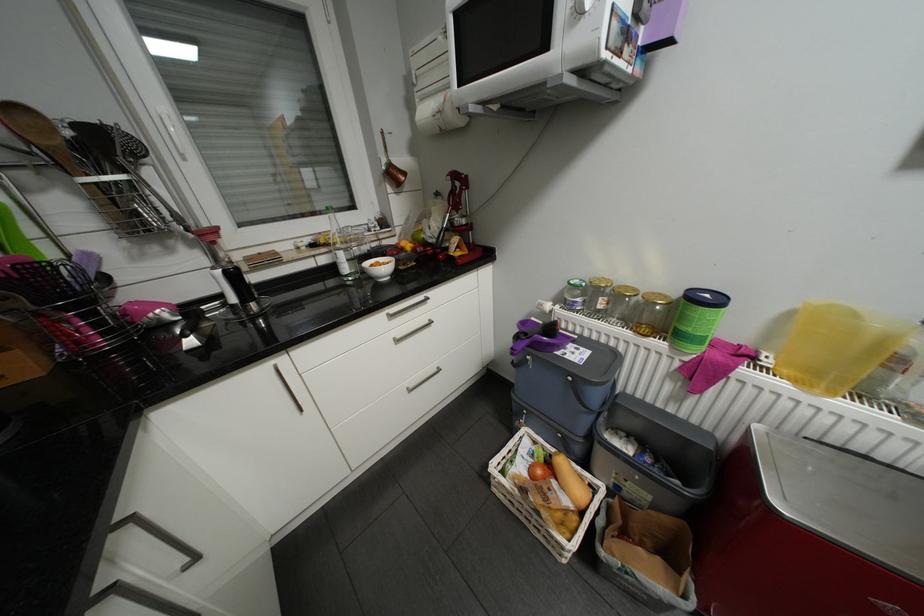
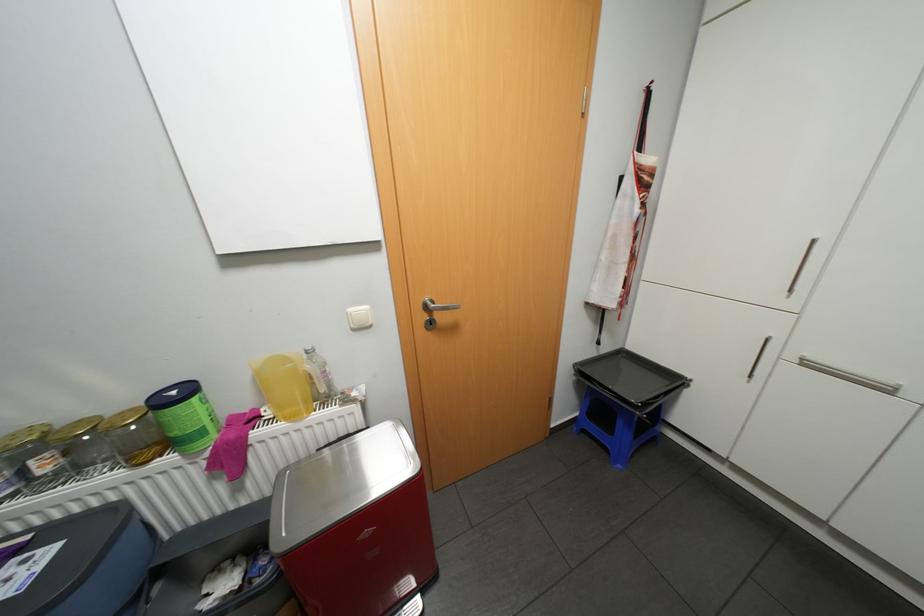
Question: I am providing you with two images of the same scene from different viewpoints. Please identify which objects are invisible in image2.

Choices:
 (A) glass jar with lid
 (B) metal door handle
 (C) yellow plastic pitcher
 (D) none of these

Answer: (D)